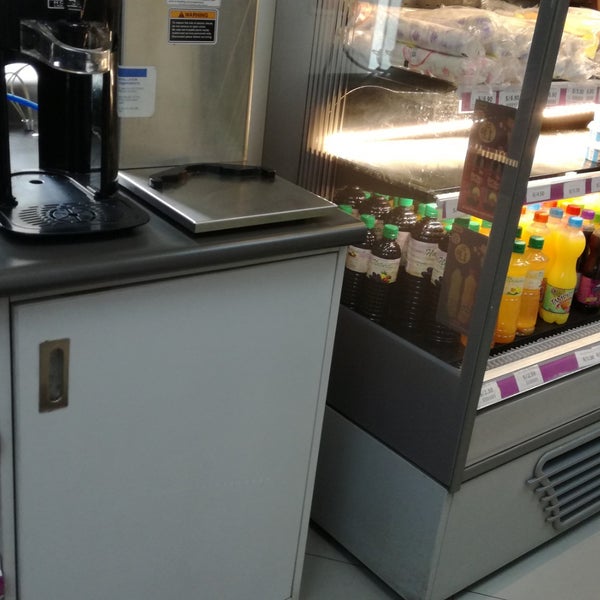
Find the location of `handle to open door`. handle to open door is located at coordinates (56, 380).